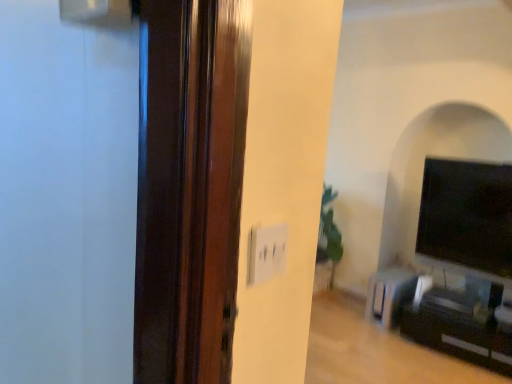
Question: Is the depth of metallic silver speaker at lower right greater than that of black glossy tv at right?

Choices:
 (A) no
 (B) yes

Answer: (B)

Question: From the image's perspective, would you say metallic silver speaker at lower right is positioned over black glossy tv at right?

Choices:
 (A) yes
 (B) no

Answer: (B)

Question: From a real-world perspective, is metallic silver speaker at lower right positioned under black glossy tv at right based on gravity?

Choices:
 (A) no
 (B) yes

Answer: (B)

Question: Considering the relative positions of metallic silver speaker at lower right and black glossy tv at right in the image provided, is metallic silver speaker at lower right to the right of black glossy tv at right from the viewer's perspective?

Choices:
 (A) no
 (B) yes

Answer: (A)

Question: Can you confirm if metallic silver speaker at lower right is smaller than black glossy tv at right?

Choices:
 (A) no
 (B) yes

Answer: (B)

Question: Is metallic silver speaker at lower right closer to camera compared to black glossy tv at right?

Choices:
 (A) yes
 (B) no

Answer: (B)

Question: Considering the relative positions of black glossy tv at right and black glossy entertainment center at lower right in the image provided, is black glossy tv at right to the right of black glossy entertainment center at lower right from the viewer's perspective?

Choices:
 (A) no
 (B) yes

Answer: (B)

Question: Considering the relative sizes of black glossy tv at right and black glossy entertainment center at lower right in the image provided, is black glossy tv at right bigger than black glossy entertainment center at lower right?

Choices:
 (A) yes
 (B) no

Answer: (B)

Question: Is black glossy tv at right behind black glossy entertainment center at lower right?

Choices:
 (A) no
 (B) yes

Answer: (B)

Question: Is black glossy entertainment center at lower right surrounded by black glossy tv at right?

Choices:
 (A) no
 (B) yes

Answer: (A)

Question: Could you tell me if black glossy tv at right is turned towards black glossy entertainment center at lower right?

Choices:
 (A) yes
 (B) no

Answer: (B)

Question: Does black glossy tv at right have a greater height compared to black glossy entertainment center at lower right?

Choices:
 (A) yes
 (B) no

Answer: (A)

Question: Does black glossy entertainment center at lower right have a greater width compared to metallic silver speaker at lower right?

Choices:
 (A) no
 (B) yes

Answer: (A)